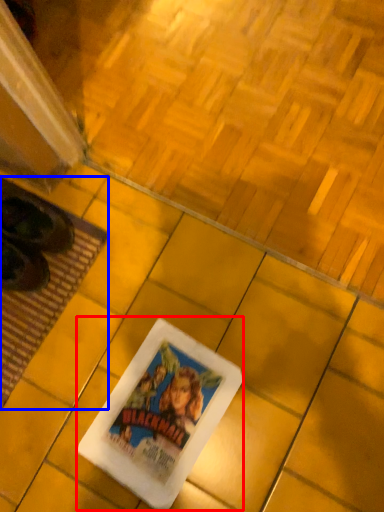
Question: Which point is closer to the camera, movie poster (highlighted by a red box) or mat (highlighted by a blue box)?

Choices:
 (A) movie poster
 (B) mat

Answer: (A)